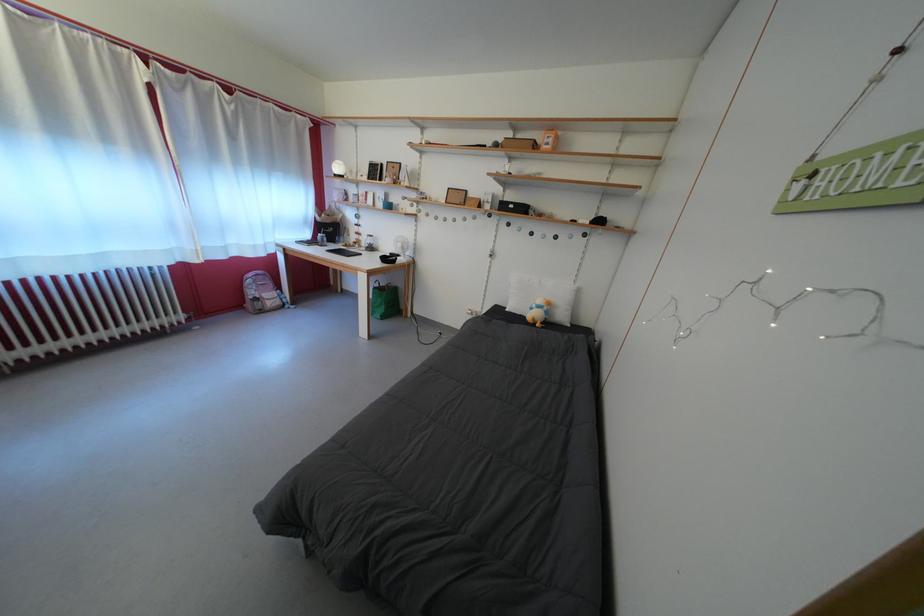
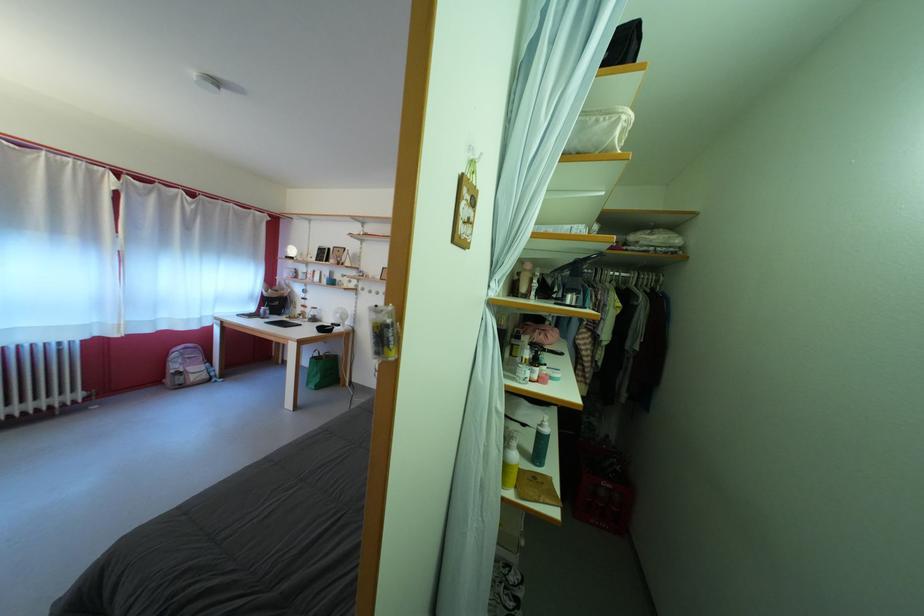
In the second image, find the point that corresponds to point 380,254 in the first image.

(322, 325)